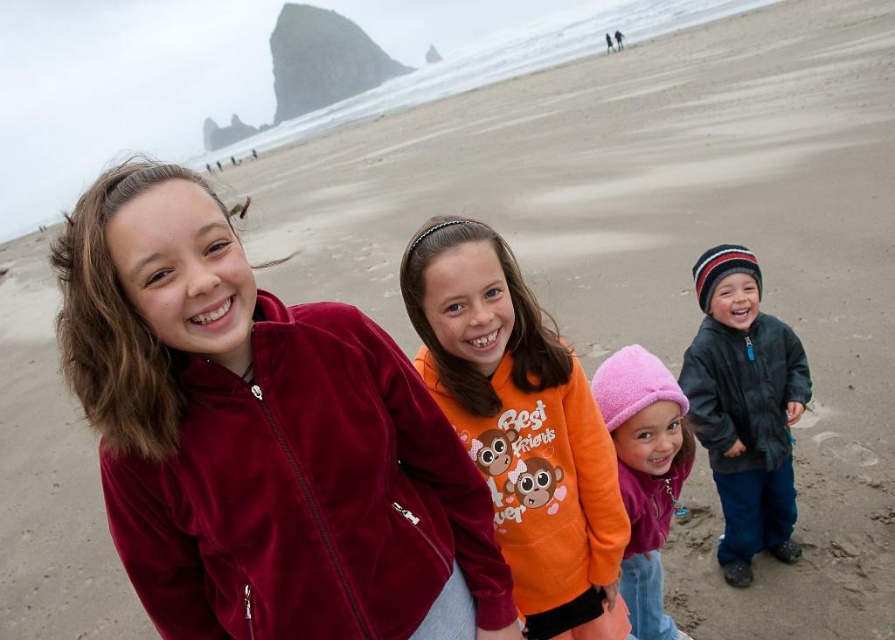
You are a photographer trying to capture a clear shot of the pink fleece hat at center and the dark gray fleece jacket at lower right. Based on their positions, which object is closer to the camera?

The dark gray fleece jacket at lower right is closer to the camera since the pink fleece hat at center is positioned behind it.

From the picture: You are a photographer trying to capture the group of children on the beach. You notice the dark gray fleece jacket at lower right. Where exactly is this jacket positioned in the image?

The dark gray fleece jacket at lower right is located at point 0.637 on the x axis and 0.832 on the y axis.